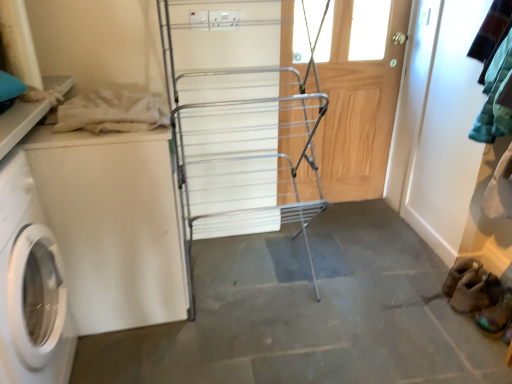
Question: From the image's perspective, does wooden screen door at center appear higher than white matte washing machine at left, which is the first washing machine from right to left?

Choices:
 (A) no
 (B) yes

Answer: (B)

Question: Is wooden screen door at center far from white matte washing machine at left, which is the first washing machine from right to left?

Choices:
 (A) yes
 (B) no

Answer: (A)

Question: Is wooden screen door at center positioned before white matte washing machine at left, which is the first washing machine from right to left?

Choices:
 (A) yes
 (B) no

Answer: (B)

Question: Considering the relative sizes of wooden screen door at center and white matte washing machine at left, which is the first washing machine from right to left, in the image provided, is wooden screen door at center shorter than white matte washing machine at left, which is the first washing machine from right to left,?

Choices:
 (A) no
 (B) yes

Answer: (A)

Question: Is white matte washing machine at left, which is the second washing machine from left to right, completely or partially inside wooden screen door at center?

Choices:
 (A) no
 (B) yes

Answer: (A)

Question: Considering their positions, is silver metallic drying rack at center located in front of or behind wooden screen door at center?

Choices:
 (A) behind
 (B) front

Answer: (B)

Question: Which is correct: silver metallic drying rack at center is inside wooden screen door at center, or outside of it?

Choices:
 (A) inside
 (B) outside

Answer: (B)

Question: In the image, is silver metallic drying rack at center on the left side or the right side of wooden screen door at center?

Choices:
 (A) right
 (B) left

Answer: (B)

Question: From the image's perspective, relative to wooden screen door at center, is silver metallic drying rack at center above or below?

Choices:
 (A) below
 (B) above

Answer: (A)

Question: Is point (256, 74) closer or farther from the camera than point (105, 218)?

Choices:
 (A) closer
 (B) farther

Answer: (B)

Question: Relative to white matte washing machine at left, which is the second washing machine from left to right, is silver metallic drying rack at center in front or behind?

Choices:
 (A) front
 (B) behind

Answer: (A)

Question: Is silver metallic drying rack at center situated inside white matte washing machine at left, which is the second washing machine from left to right, or outside?

Choices:
 (A) outside
 (B) inside

Answer: (A)

Question: Looking at their shapes, would you say silver metallic drying rack at center is wider or thinner than white matte washing machine at left, which is the second washing machine from left to right?

Choices:
 (A) thin
 (B) wide

Answer: (B)

Question: From the image's perspective, is gray concrete floor at center positioned above or below brown suede shoe at lower right, which ranks as the second shoe in back-to-front order?

Choices:
 (A) below
 (B) above

Answer: (A)

Question: Is gray concrete floor at center bigger or smaller than brown suede shoe at lower right, which ranks as the second shoe in back-to-front order?

Choices:
 (A) small
 (B) big

Answer: (B)